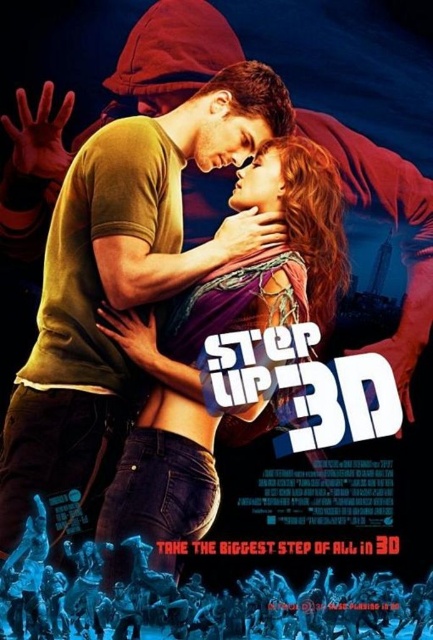
Consider the image. You are a movie poster designer working on the Step Up 3D poster. You need to place a new element at a position that is in front of both point (230,196) and point (342,632). Where should you place it?

The new element should be placed in front of both points. Since point (230,196) is behind point (342,632), placing the new element in front of point (342,632) will ensure it is also in front of point (230,196).